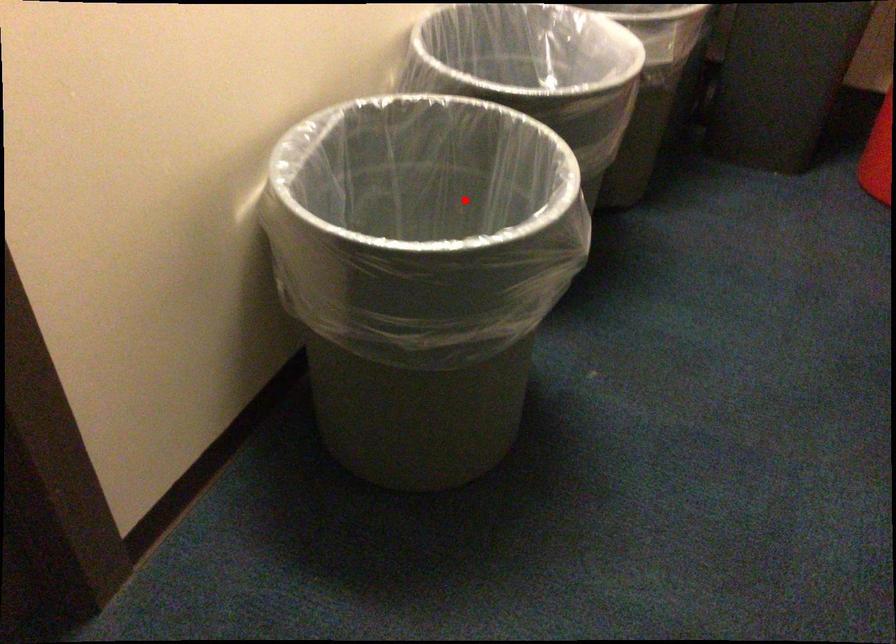
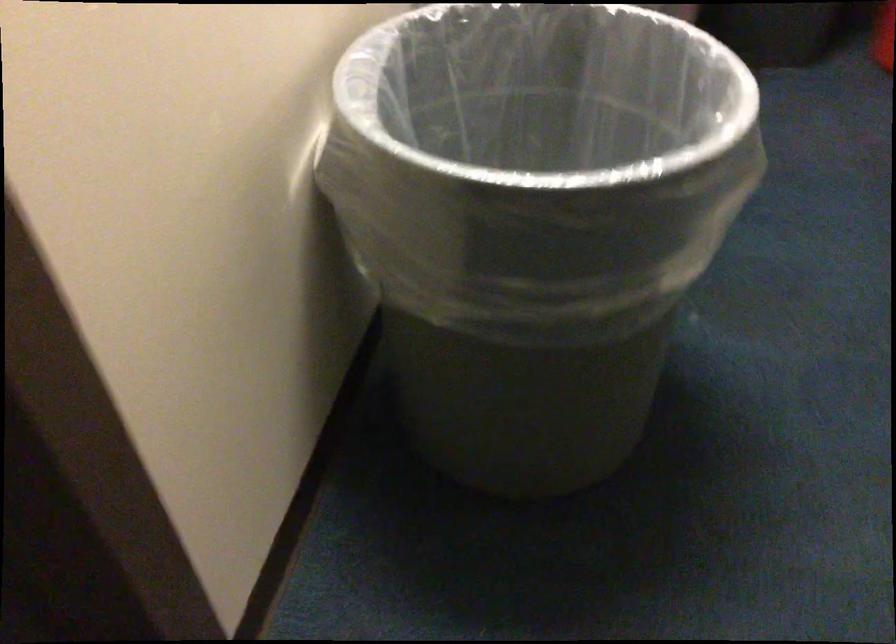
Locate, in the second image, the point that corresponds to the highlighted location in the first image.

(538, 136)